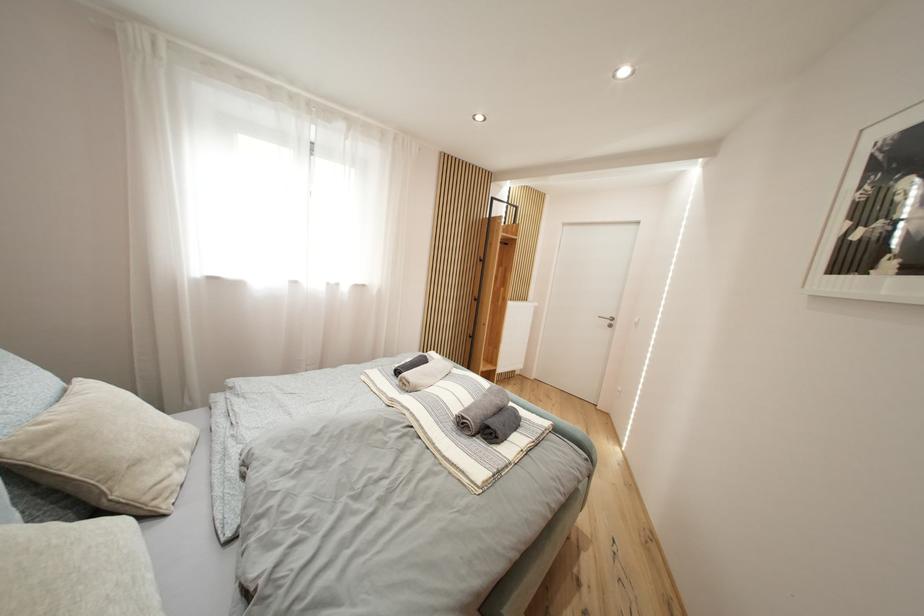
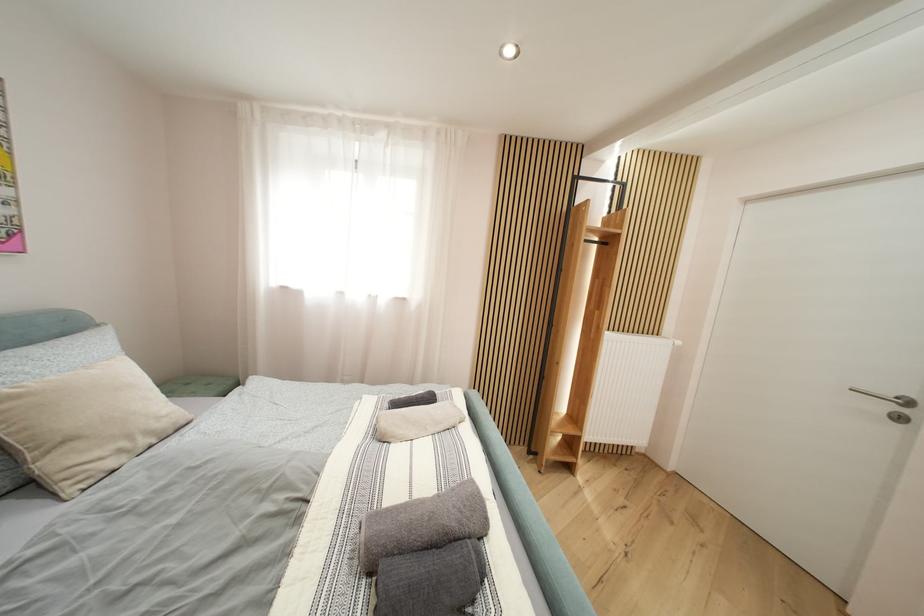
Question: The camera is either moving clockwise (left) or counter-clockwise (right) around the object. The first image is from the beginning of the video and the second image is from the end. Is the camera moving left or right when shooting the video?

Choices:
 (A) Left
 (B) Right

Answer: (B)